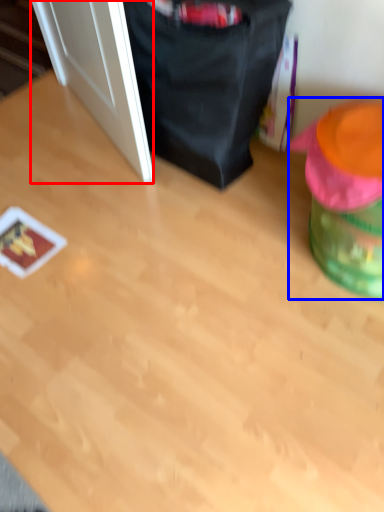
Question: Which object appears farthest to the camera in this image, door (highlighted by a red box) or bean bag chair (highlighted by a blue box)?

Choices:
 (A) door
 (B) bean bag chair

Answer: (A)